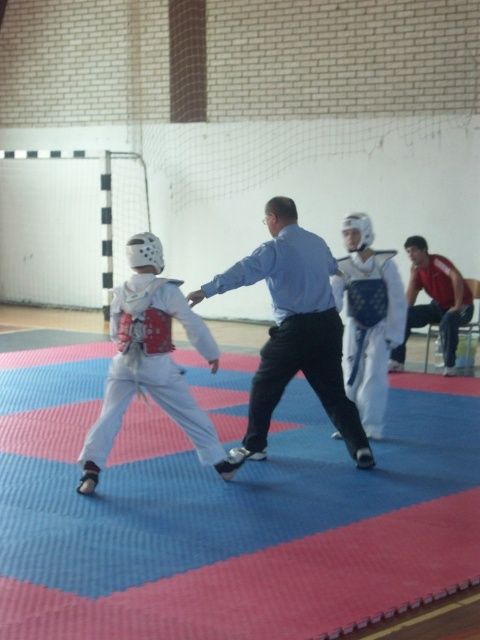
Is blue rubber mat at center shorter than white matte uniform at center?

Indeed, blue rubber mat at center has a lesser height compared to white matte uniform at center.

What do you see at coordinates (237, 524) in the screenshot? The image size is (480, 640). I see `blue rubber mat at center` at bounding box center [237, 524].

The image size is (480, 640). Identify the location of blue rubber mat at center. (237, 524).

Who is taller, white matte karate uniform at left or red fabric shirt at right?

white matte karate uniform at left

Can you confirm if white matte karate uniform at left is wider than red fabric shirt at right?

Yes, white matte karate uniform at left is wider than red fabric shirt at right.

Describe the element at coordinates (152, 362) in the screenshot. The height and width of the screenshot is (640, 480). I see `white matte karate uniform at left` at that location.

Where is `white matte karate uniform at left`? The image size is (480, 640). white matte karate uniform at left is located at coordinates (152, 362).

Who is shorter, blue rubber mat at center or red fabric shirt at right?

blue rubber mat at center

Does point (144, 600) come farther from viewer compared to point (464, 300)?

No, (144, 600) is closer to viewer.

The image size is (480, 640). Find the location of `blue rubber mat at center`. blue rubber mat at center is located at coordinates (237, 524).